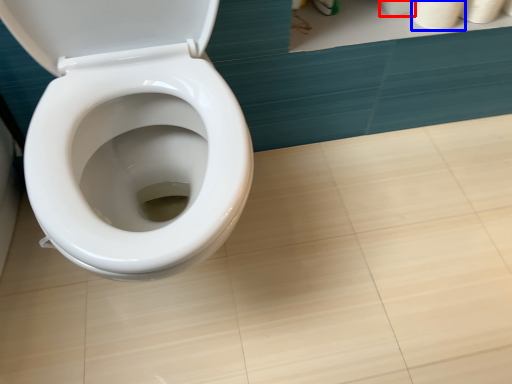
Question: Which object is further to the camera taking this photo, toilet paper (highlighted by a red box) or toilet paper (highlighted by a blue box)?

Choices:
 (A) toilet paper
 (B) toilet paper

Answer: (A)